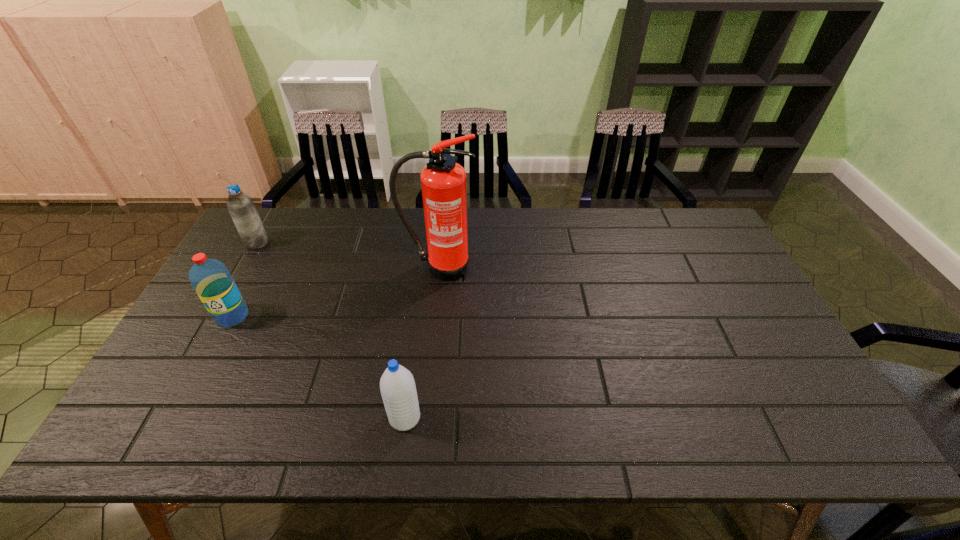
Locate an element on the screen. fire extinguisher is located at coordinates (443, 181).

Image resolution: width=960 pixels, height=540 pixels. What are the coordinates of `the second farthest object` in the screenshot? It's located at (443, 181).

This screenshot has width=960, height=540. In order to click on the second nearest object in this screenshot , I will do pos(210,278).

Find the location of a particular element. This screenshot has height=540, width=960. the farthest object is located at coordinates (240, 206).

Where is `the nearest water bottle`? The height and width of the screenshot is (540, 960). the nearest water bottle is located at coordinates (397, 385).

Find the location of a particular element. This screenshot has height=540, width=960. the rightmost water bottle is located at coordinates (397, 385).

In order to click on vacant space located at the nozzle of the fire extinguisher in this screenshot , I will do `click(429, 366)`.

Where is `vacant space located on the front label of the second nearest object`? The width and height of the screenshot is (960, 540). vacant space located on the front label of the second nearest object is located at coordinates (206, 365).

The height and width of the screenshot is (540, 960). What are the coordinates of `free region located 0.150m on the right of the farthest water bottle` in the screenshot? It's located at (313, 242).

You are a GUI agent. You are given a task and a screenshot of the screen. Output one action in this format:
    pyautogui.click(x=<x>, y=<y>)
    Task: Click on the vacant region located on the right of the nearest water bottle
    This screenshot has height=540, width=960.
    Given the screenshot: What is the action you would take?
    pyautogui.click(x=554, y=417)